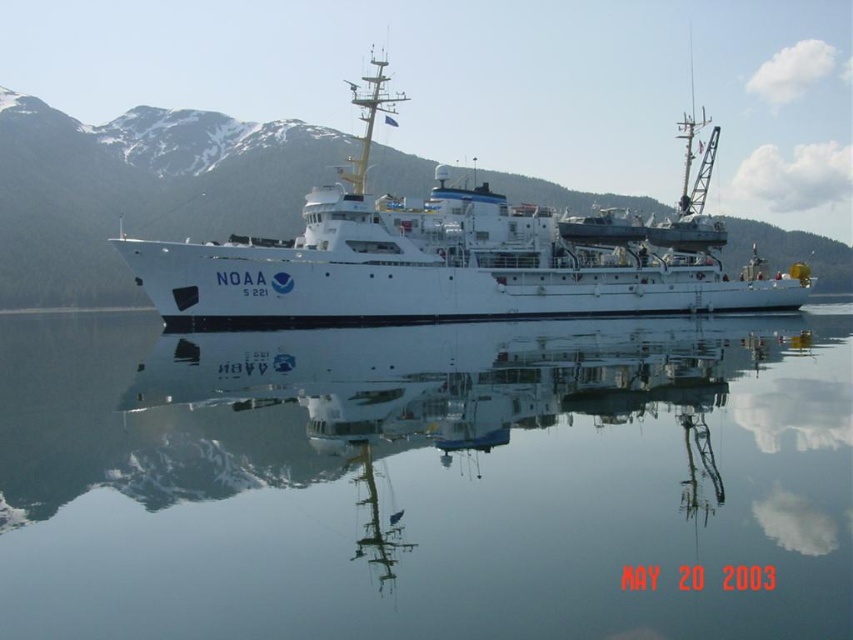
You are a marine biologist observing the NOAA research vessel from a helicopter above. You notice the clear glass water at center and the white matte ship at center. Which object appears shorter from your aerial view?

The clear glass water at center appears shorter than the white matte ship at center because the description states that the clear glass water has a lesser height compared to the white matte ship at center.

You are a marine biologist observing the NOAA research vessel from the shore. You notice the clear glass water at center and the white matte ship at center. Which object is located to the left of the other?

The clear glass water at center is positioned on the left side of white matte ship at center, so the clear glass water at center is to the left of the white matte ship at center.